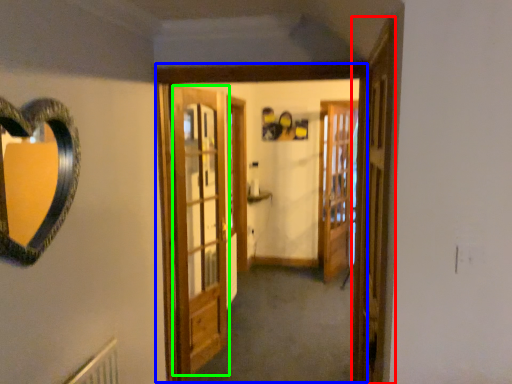
Question: Which object is positioned farthest from screen door (highlighted by a red box)? Select from window frame (highlighted by a blue box) and barn door (highlighted by a green box).

Choices:
 (A) window frame
 (B) barn door

Answer: (B)